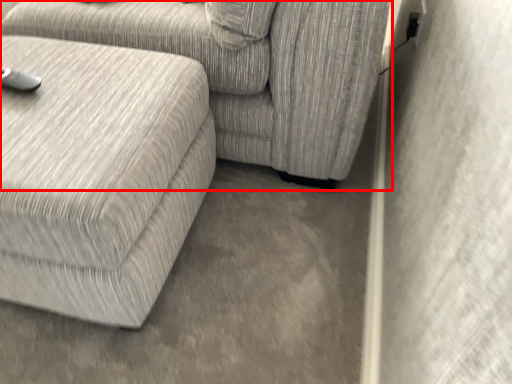
Question: From the image's perspective, what is the correct spatial positioning of studio couch (annotated by the red box) in reference to studio couch?

Choices:
 (A) below
 (B) above

Answer: (B)